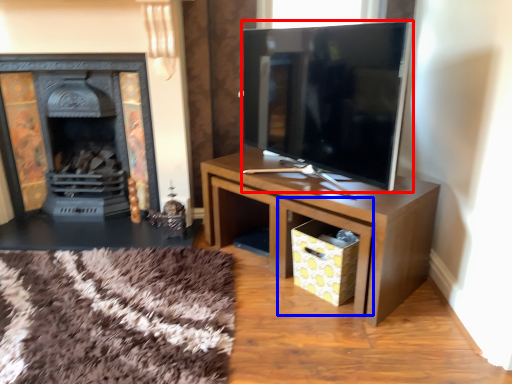
Question: Among these objects, which one is farthest to the camera, television (highlighted by a red box) or drawer (highlighted by a blue box)?

Choices:
 (A) television
 (B) drawer

Answer: (B)